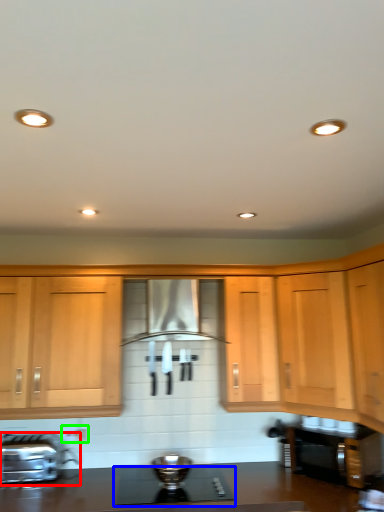
Question: Which object is positioned farthest from kitchen appliance (highlighted by a red box)? Select from gas stove (highlighted by a blue box) and electric outlet (highlighted by a green box).

Choices:
 (A) gas stove
 (B) electric outlet

Answer: (A)